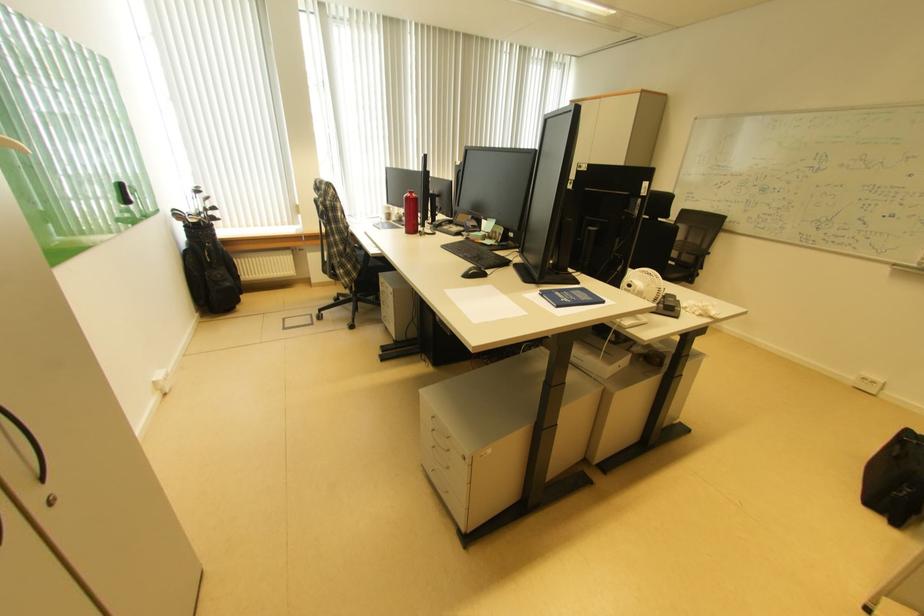
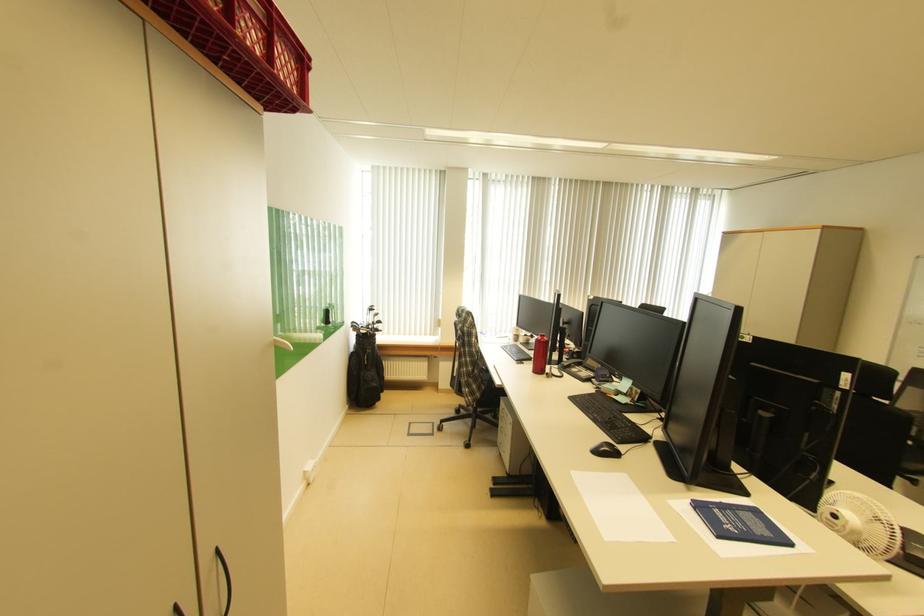
What movement of the cameraman would produce the second image?

The cameraman walked toward left, backward.